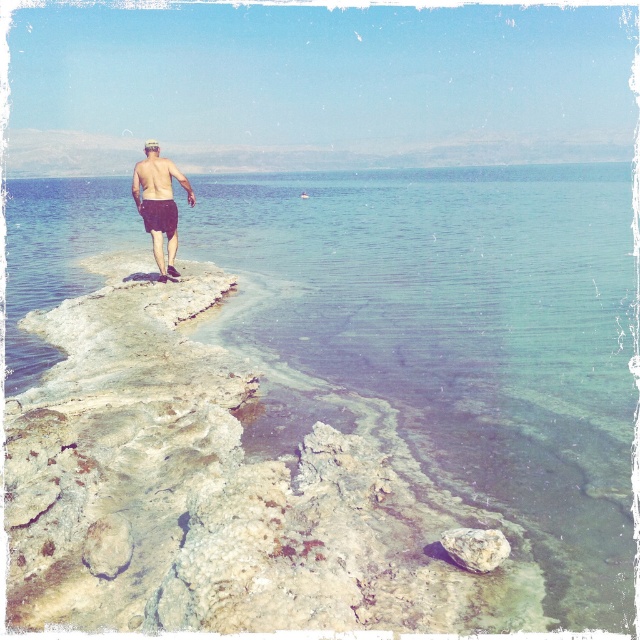
Question: Can you confirm if matte black shorts at center is smaller than black matte shorts at center?

Choices:
 (A) yes
 (B) no

Answer: (B)

Question: Among these points, which one is nearest to the camera?

Choices:
 (A) (141, 220)
 (B) (157, 205)
 (C) (481, 538)
 (D) (500, 216)

Answer: (C)

Question: Can you confirm if clear saltwater at center is positioned above smooth gray rock at lower right?

Choices:
 (A) no
 (B) yes

Answer: (B)

Question: Can you confirm if smooth gray rock at lower right is smaller than black matte shorts at center?

Choices:
 (A) yes
 (B) no

Answer: (A)

Question: Which object is positioned closest to the matte black shorts at center?

Choices:
 (A) black matte shorts at center
 (B) clear saltwater at center
 (C) smooth gray rock at lower right

Answer: (A)

Question: Among these objects, which one is farthest from the camera?

Choices:
 (A) smooth gray rock at lower right
 (B) matte black shorts at center
 (C) clear saltwater at center

Answer: (B)